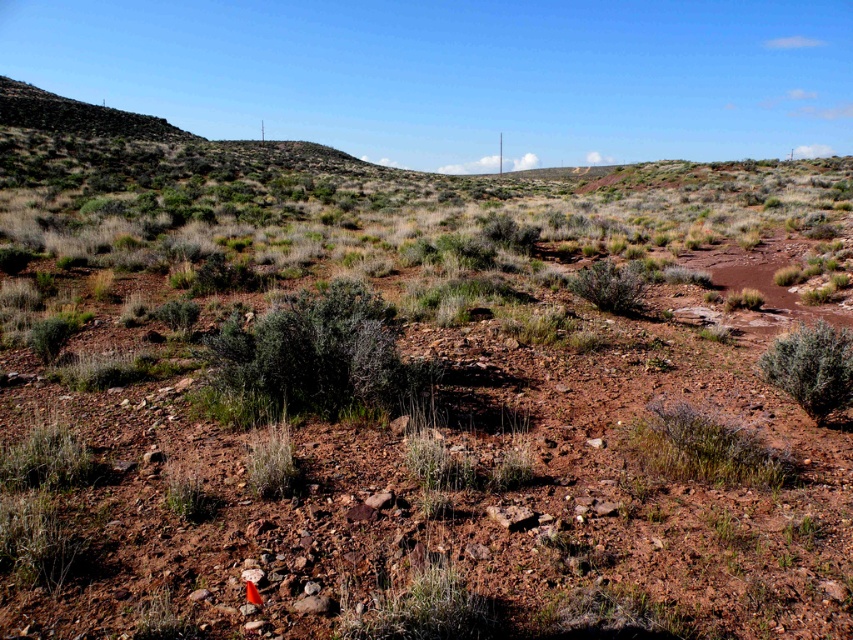
You are planning to plant a new tree in this arid landscape. The tree requires a spot that is taller than the green fuzzy bush at right. Can you determine if the area near the green shrub at center is suitable?

The green shrub at center is much taller than the green fuzzy bush at right, so the area near the green shrub at center meets the requirement of being taller than the green fuzzy bush at right. Therefore, it is suitable for planting the tree.

You are navigating a drone through the arid landscape and need to fly between the two points, point (335, 332) and point (846, 397). Which point is closer to your current position if you are at the same elevation as the terrain?

Point (335, 332) is closer to your current position because it is further to the viewer than point (846, 397), meaning it lies between you and the other point.